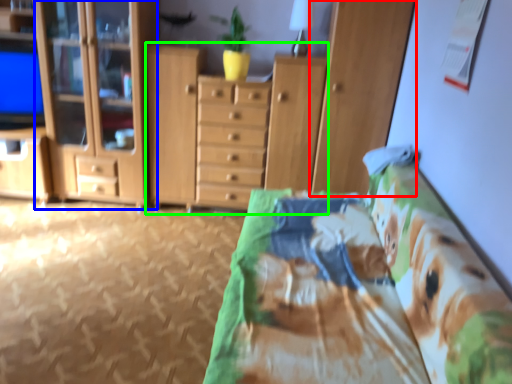
Question: Which is nearer to the cabinetry (highlighted by a red box)? cabinetry (highlighted by a blue box) or cupboard (highlighted by a green box).

Choices:
 (A) cabinetry
 (B) cupboard

Answer: (B)